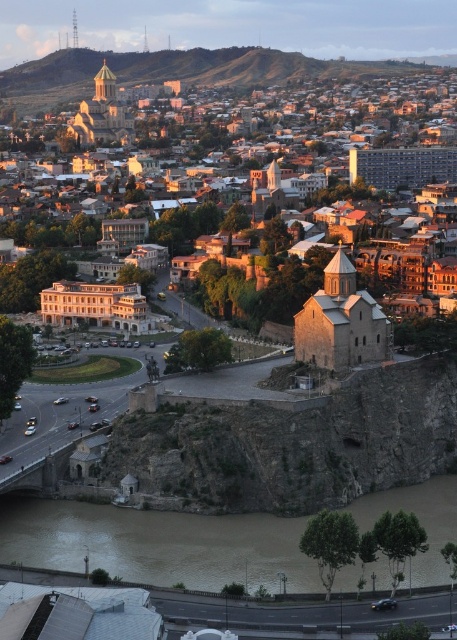
Question: Is stone church at center closer to camera compared to brown muddy water at lower center?

Choices:
 (A) yes
 (B) no

Answer: (B)

Question: Which point appears closest to the camera in this image?

Choices:
 (A) (210, 525)
 (B) (174, 104)

Answer: (A)

Question: Does stone church at center have a lesser width compared to brown muddy water at lower center?

Choices:
 (A) yes
 (B) no

Answer: (B)

Question: Is stone church at center to the left of brown muddy water at lower center from the viewer's perspective?

Choices:
 (A) no
 (B) yes

Answer: (A)

Question: Which point is closer to the camera taking this photo?

Choices:
 (A) tap(450, 273)
 (B) tap(159, 516)

Answer: (B)